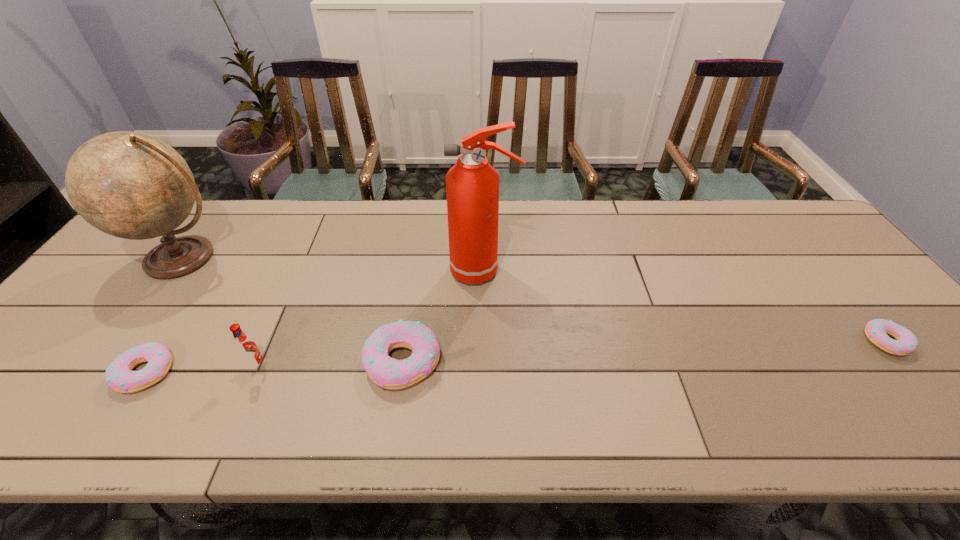
To achieve uniform spacing by inserting another doughnut among them, please point to a free space for this new doughnut. Please provide its 2D coordinates. Your answer should be formatted as a tuple, i.e. [(x, y)], where the tuple contains the x and y coordinates of a point satisfying the conditions above.

[(649, 351)]